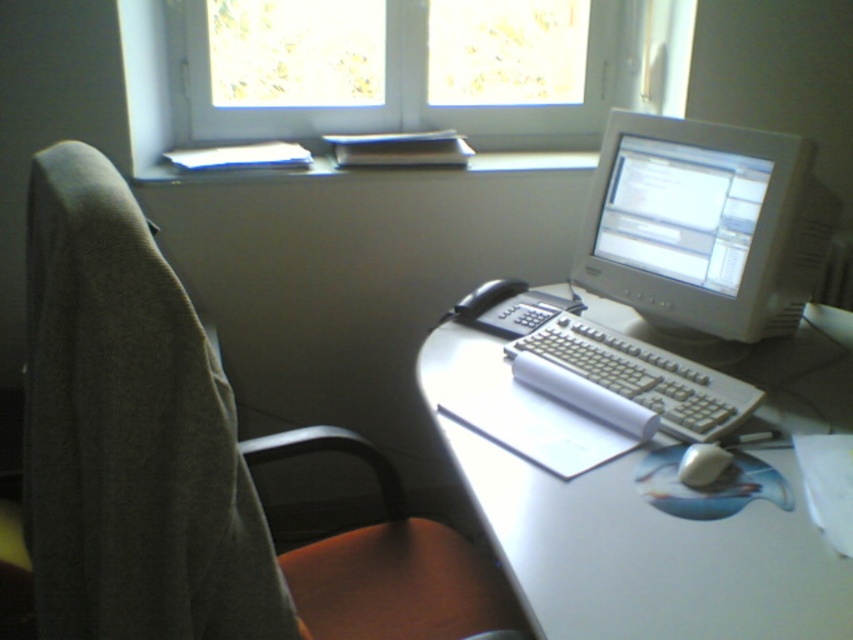
You are organizing a small meeting in the workspace shown. You need to place a 1.2 meter long tablecloth on either the white plastic computer desk at center or the transparent glass window at upper center. Which one can accommodate the tablecloth without it hanging off the edges?

The white plastic computer desk at center has a larger width than the transparent glass window at upper center, so the tablecloth can be placed on the white plastic computer desk at center.

You are setting up a new desk arrangement and want to place both the white plastic monitor at upper right and the white glossy monitor at upper right side by side on your desk. Which monitor should be placed first to ensure they fit properly?

The white glossy monitor at upper right should be placed first since it has a smaller width compared to the white plastic monitor at upper right, allowing more space for positioning both monitors side by side.

Consider the image. You are standing in front of the desk and want to place a new mouse. Where should you place the new mouse so that it is positioned to the right of the white plastic monitor at upper right?

The white plastic monitor at upper right is located at coordinates 0.353 on the x and 0.828 on the y. To place the new mouse to the right of it, position it at a higher x value than 0.353 while maintaining the same y coordinate.